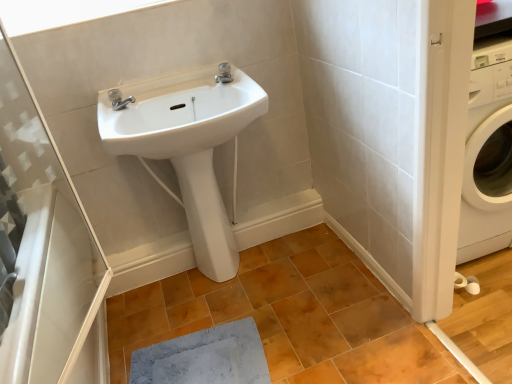
Image resolution: width=512 pixels, height=384 pixels. What are the coordinates of `free space on the front side of white glossy bidet at center` in the screenshot? It's located at (224, 301).